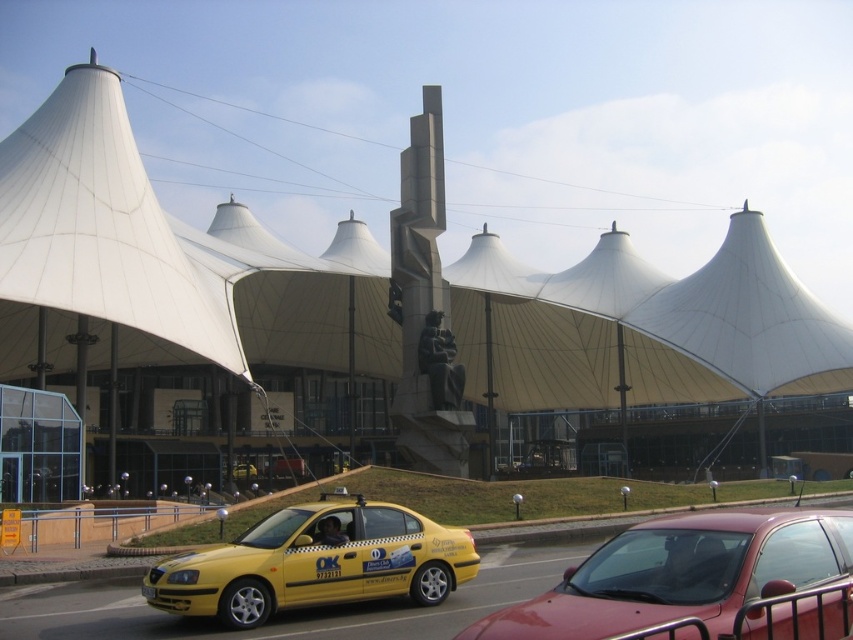
Question: Which object is farther from the camera taking this photo?

Choices:
 (A) matte red sedan at center
 (B) yellow plastic license plate at center
 (C) white fabric canopy at upper left
 (D) yellow matte taxi at lower left

Answer: (C)

Question: Is white fabric tent at center positioned in front of white fabric canopy at upper left?

Choices:
 (A) no
 (B) yes

Answer: (A)

Question: Which object is the closest to the matte red sedan at center?

Choices:
 (A) white fabric tent at center
 (B) yellow plastic license plate at center

Answer: (B)

Question: In this image, where is white fabric canopy at upper left located relative to yellow plastic license plate at center?

Choices:
 (A) above
 (B) below

Answer: (A)

Question: Does white fabric tent at center have a lesser width compared to yellow matte taxi at lower left?

Choices:
 (A) yes
 (B) no

Answer: (B)

Question: Which of the following is the farthest from the observer?

Choices:
 (A) (338, 572)
 (B) (401, 552)
 (C) (830, 596)

Answer: (B)